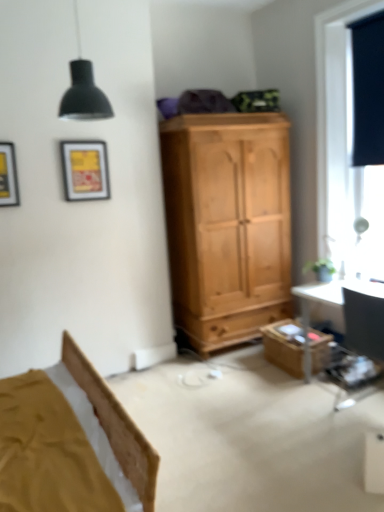
Question: Is matte yellow picture frame at upper left, placed as the 1th picture frame when sorted from right to left, turned away from matte yellow picture frame at upper left, which ranks as the second picture frame in back-to-front order?

Choices:
 (A) yes
 (B) no

Answer: (B)

Question: Is matte yellow picture frame at upper left, placed as the 1th picture frame when sorted from right to left, not inside matte yellow picture frame at upper left, which ranks as the second picture frame in back-to-front order?

Choices:
 (A) yes
 (B) no

Answer: (A)

Question: Considering the relative sizes of matte yellow picture frame at upper left, the second picture frame when ordered from left to right, and matte yellow picture frame at upper left, arranged as the second picture frame when viewed from the right, in the image provided, is matte yellow picture frame at upper left, the second picture frame when ordered from left to right, thinner than matte yellow picture frame at upper left, arranged as the second picture frame when viewed from the right,?

Choices:
 (A) yes
 (B) no

Answer: (B)

Question: Is matte yellow picture frame at upper left, the 1th picture frame viewed from the back, bigger than matte yellow picture frame at upper left, which is counted as the first picture frame, starting from the left?

Choices:
 (A) yes
 (B) no

Answer: (B)

Question: Can matte yellow picture frame at upper left, which ranks as the second picture frame in back-to-front order, be found inside matte yellow picture frame at upper left, marked as the second picture frame in a front-to-back arrangement?

Choices:
 (A) yes
 (B) no

Answer: (B)

Question: Considering their positions, is black matte curtain at upper right located in front of or behind black matte lampshade at upper left?

Choices:
 (A) behind
 (B) front

Answer: (A)

Question: From the image's perspective, is black matte curtain at upper right above or below black matte lampshade at upper left?

Choices:
 (A) below
 (B) above

Answer: (B)

Question: From a real-world perspective, is black matte curtain at upper right positioned above or below black matte lampshade at upper left?

Choices:
 (A) above
 (B) below

Answer: (B)

Question: Considering the positions of point (382, 87) and point (87, 66), is point (382, 87) closer or farther from the camera than point (87, 66)?

Choices:
 (A) farther
 (B) closer

Answer: (A)

Question: Is matte yellow picture frame at upper left, arranged as the second picture frame when viewed from the right, bigger or smaller than matte yellow picture frame at upper left, the second picture frame when ordered from left to right?

Choices:
 (A) big
 (B) small

Answer: (A)

Question: Is matte yellow picture frame at upper left, which is counted as the first picture frame, starting from the left, to the left or to the right of matte yellow picture frame at upper left, the second picture frame when ordered from left to right, in the image?

Choices:
 (A) left
 (B) right

Answer: (A)

Question: Considering their positions, is matte yellow picture frame at upper left, which is counted as the first picture frame, starting from the left, located in front of or behind matte yellow picture frame at upper left, placed as the 1th picture frame when sorted from right to left?

Choices:
 (A) front
 (B) behind

Answer: (A)

Question: Does point (0, 141) appear closer or farther from the camera than point (72, 146)?

Choices:
 (A) farther
 (B) closer

Answer: (B)

Question: In the image, is black matte lampshade at upper left positioned in front of or behind wooden box at lower right?

Choices:
 (A) behind
 (B) front

Answer: (B)

Question: Is black matte lampshade at upper left situated inside wooden box at lower right or outside?

Choices:
 (A) outside
 (B) inside

Answer: (A)